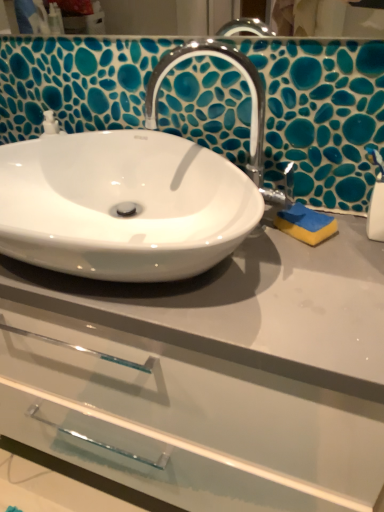
Question: Is yellow sponge at right completely or partially inside white glossy sink at center?

Choices:
 (A) yes
 (B) no

Answer: (B)

Question: Does white glossy sink at center have a lesser width compared to yellow sponge at right?

Choices:
 (A) no
 (B) yes

Answer: (A)

Question: From the image's perspective, is white glossy sink at center under yellow sponge at right?

Choices:
 (A) no
 (B) yes

Answer: (A)

Question: Is white glossy sink at center positioned with its back to yellow sponge at right?

Choices:
 (A) yes
 (B) no

Answer: (B)

Question: Is white glossy sink at center taller than yellow sponge at right?

Choices:
 (A) no
 (B) yes

Answer: (B)

Question: Is white plastic soap dispenser at right in front of or behind white glossy sink at center in the image?

Choices:
 (A) front
 (B) behind

Answer: (B)

Question: Does point (382, 224) appear closer or farther from the camera than point (49, 118)?

Choices:
 (A) closer
 (B) farther

Answer: (A)

Question: Considering the relative positions of white plastic soap dispenser at right and white glossy sink at center in the image provided, is white plastic soap dispenser at right to the left or to the right of white glossy sink at center?

Choices:
 (A) left
 (B) right

Answer: (B)

Question: From a real-world perspective, is white plastic soap dispenser at right above or below white glossy sink at center?

Choices:
 (A) below
 (B) above

Answer: (A)

Question: Based on their sizes in the image, would you say white glossy drawer at center is bigger or smaller than white plastic soap dispenser at right?

Choices:
 (A) big
 (B) small

Answer: (A)

Question: Considering their positions, is white glossy drawer at center located in front of or behind white plastic soap dispenser at right?

Choices:
 (A) front
 (B) behind

Answer: (A)

Question: Is white glossy drawer at center taller or shorter than white plastic soap dispenser at right?

Choices:
 (A) tall
 (B) short

Answer: (A)

Question: Is point (205, 457) positioned closer to the camera than point (374, 190)?

Choices:
 (A) farther
 (B) closer

Answer: (A)

Question: Is yellow sponge at right inside the boundaries of white glossy sink at center, or outside?

Choices:
 (A) inside
 (B) outside

Answer: (B)

Question: From the image's perspective, is yellow sponge at right located above or below white glossy sink at center?

Choices:
 (A) above
 (B) below

Answer: (B)